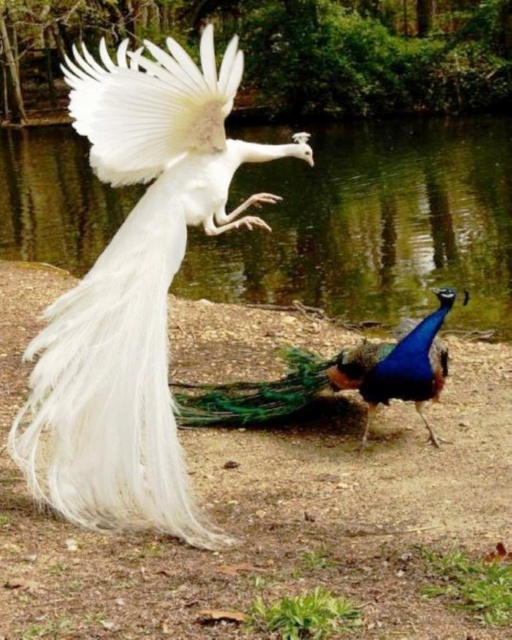
Consider the image. You are a photographer aiming to capture the white feathered peacock at center and the transparent water at center in a single shot. Which object will appear larger in your photo?

The white feathered peacock at center will appear larger in the photo because it is closer to the viewer than the transparent water at center.

You are a photographer trying to capture both the transparent water at center and the blue glossy peacock at center in a single frame. Given their sizes, which one will occupy more of the photo?

The transparent water at center has a larger size compared to the blue glossy peacock at center, so it will occupy more space in the photo.

You are a wildlife photographer aiming to capture both the white feathered peacock at center and the blue glossy peacock at center in a single frame. Considering their sizes, which peacock should you focus on first to ensure both fit in the shot?

The white feathered peacock at center is larger than the blue glossy peacock at center. To ensure both fit in the shot, focus on the white feathered peacock at center first as it requires more space, then adjust the frame to include the smaller blue glossy peacock at center.